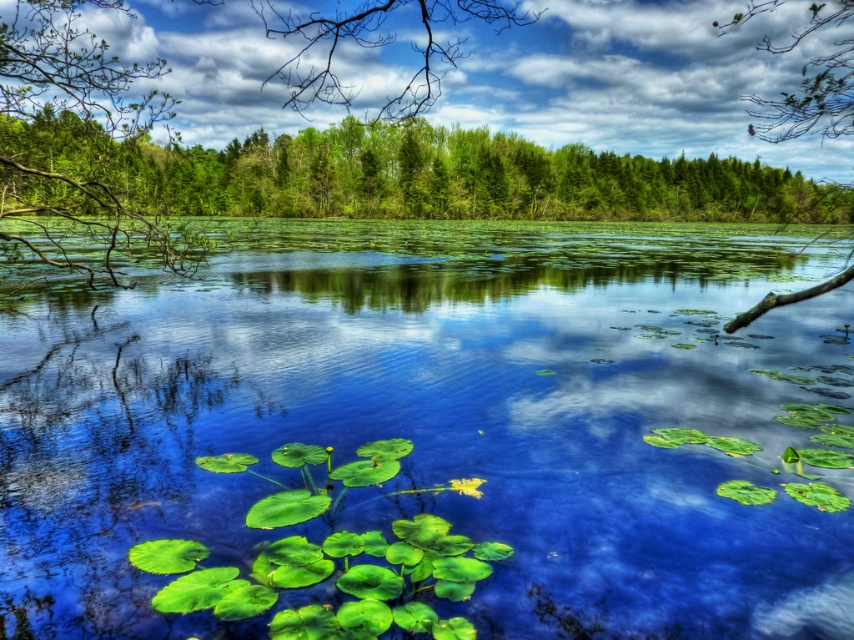
From the picture: Can you confirm if green leafy tree at upper center is positioned below green leafy branch at upper left?

Yes, green leafy tree at upper center is below green leafy branch at upper left.

In the scene shown: Does green leafy tree at upper center have a lesser height compared to green leafy branch at upper left?

Indeed, green leafy tree at upper center has a lesser height compared to green leafy branch at upper left.

Is point (692, 179) positioned in front of point (34, 17)?

No, (692, 179) is behind (34, 17).

Locate an element on the screen. This screenshot has width=854, height=640. green leafy tree at upper center is located at coordinates (414, 176).

Describe the element at coordinates (428, 435) in the screenshot. I see `green glossy lily pads at center` at that location.

Is green glossy lily pads at center bigger than green leafy branch at upper left?

Actually, green glossy lily pads at center might be smaller than green leafy branch at upper left.

Where is `green glossy lily pads at center`? The height and width of the screenshot is (640, 854). green glossy lily pads at center is located at coordinates (428, 435).

Locate an element on the screen. This screenshot has height=640, width=854. green glossy lily pads at center is located at coordinates (428, 435).

Does green leafy branch at upper left have a smaller size compared to smooth bark branch at right?

Yes, green leafy branch at upper left is smaller than smooth bark branch at right.

Who is positioned more to the right, green leafy branch at upper left or smooth bark branch at right?

Positioned to the right is smooth bark branch at right.

Between point (120, 192) and point (798, 128), which one is positioned in front?

Point (120, 192)

Find the location of a particular element. Image resolution: width=854 pixels, height=640 pixels. green leafy branch at upper left is located at coordinates (72, 128).